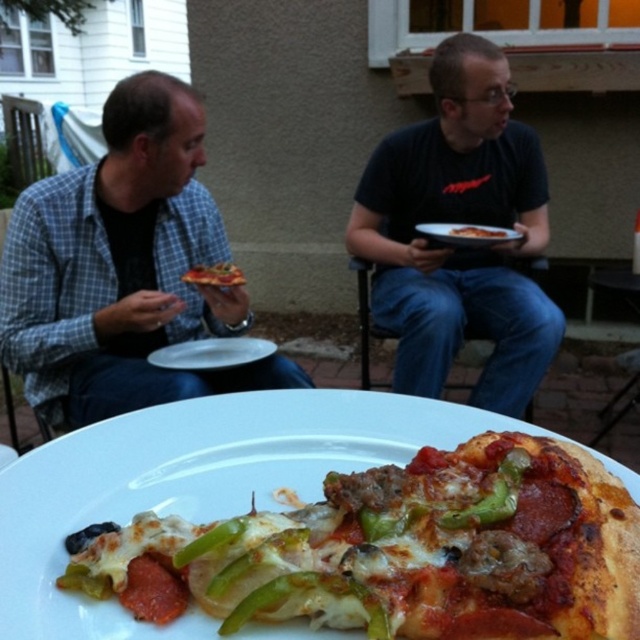
Question: Which point is closer to the camera?

Choices:
 (A) pepperoni and green bell pepper pizza at center
 (B) cheesy pepperoni pizza at center
 (C) white matte plate at center

Answer: (A)

Question: Which is farther from the black matte shirt at upper center?

Choices:
 (A) cheesy pepperoni pizza at center
 (B) white glossy plate at center
 (C) matte black shirt at left

Answer: (B)

Question: Which point is farther to the camera?

Choices:
 (A) matte black shirt at left
 (B) cheesy pepperoni pizza at center
 (C) pepperoni and green bell pepper pizza at center

Answer: (B)

Question: Is matte black shirt at left positioned at the back of cheesy pepperoni pizza at center?

Choices:
 (A) no
 (B) yes

Answer: (A)

Question: Is matte black shirt at left bigger than white matte plate at center?

Choices:
 (A) yes
 (B) no

Answer: (A)

Question: Is the position of pepperoni and green bell pepper pizza at center more distant than that of white glossy plate at center?

Choices:
 (A) yes
 (B) no

Answer: (B)